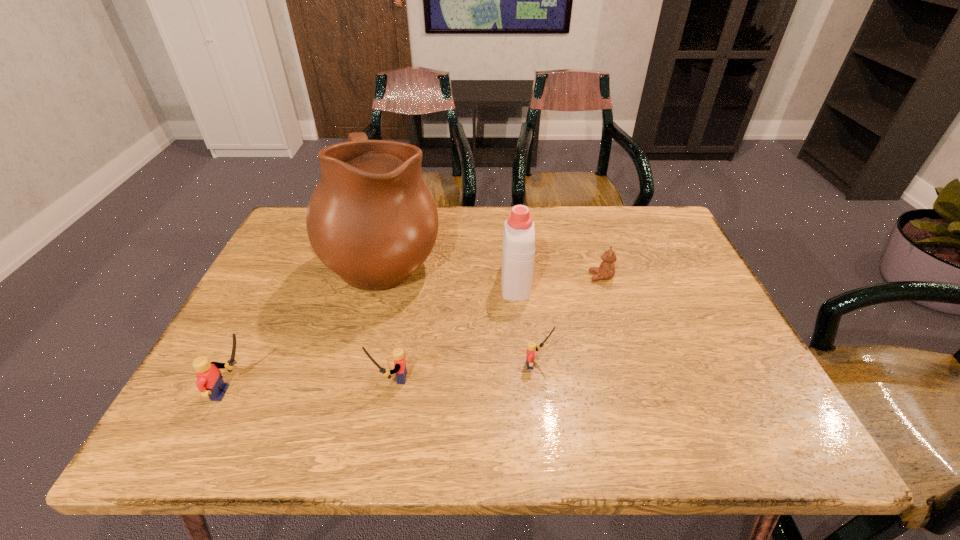
The image size is (960, 540). Identify the location of free space that is in between the teddy bear and the cream pitcher. (493, 267).

The image size is (960, 540). What are the coordinates of `free space between the teddy bear and the tallest Lego` in the screenshot? It's located at (418, 335).

Identify the location of vacant point located between the tallest Lego and the teddy bear. This screenshot has width=960, height=540. (418, 335).

At what (x,y) coordinates should I click in order to perform the action: click on free spot between the second Lego from right to left and the rightmost Lego. Please return your answer as a coordinate pair (x, y). Looking at the image, I should click on (465, 372).

Locate an element on the screen. free space between the cream pitcher and the detergent is located at coordinates (450, 269).

At what (x,y) coordinates should I click in order to perform the action: click on free point between the rightmost Lego and the rightmost object. Please return your answer as a coordinate pair (x, y). The image size is (960, 540). Looking at the image, I should click on (569, 321).

At what (x,y) coordinates should I click in order to perform the action: click on vacant space that's between the second shortest Lego and the third tallest object. Please return your answer as a coordinate pair (x, y). Looking at the image, I should click on (313, 386).

This screenshot has height=540, width=960. What are the coordinates of `vacant area that lies between the teddy bear and the leftmost Lego` in the screenshot? It's located at (418, 335).

Select which object is the fifth closest to the rightmost object. Please provide its 2D coordinates. Your answer should be formatted as a tuple, i.e. [(x, y)], where the tuple contains the x and y coordinates of a point satisfying the conditions above.

[(210, 382)]

Locate which object ranks fourth in proximity to the leftmost Lego. Please provide its 2D coordinates. Your answer should be formatted as a tuple, i.e. [(x, y)], where the tuple contains the x and y coordinates of a point satisfying the conditions above.

[(518, 249)]